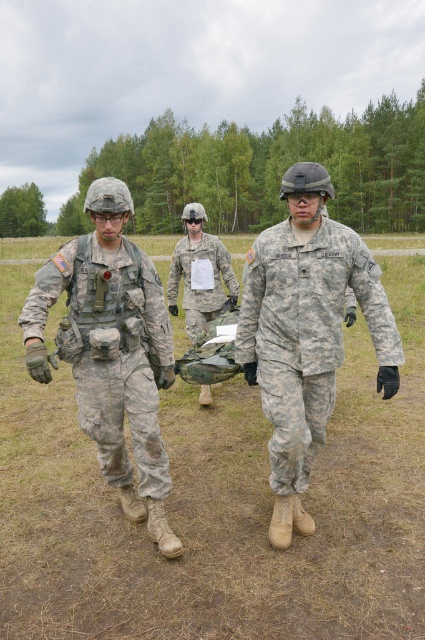
You are a photographer trying to capture a clear image of the camouflage uniform at center and the camouflage fabric bag at center. Since both are in the center, which one will appear wider in the photo?

The camouflage uniform at center will appear wider in the photo because its width surpasses that of the camouflage fabric bag at center.

You are a drone operator observing three soldiers in a training exercise. You notice two soldiers labeled as camouflage uniform at center and camouflage uniform at left. Which soldier is closer to the drone based on their size?

The camouflage uniform at center is smaller than camouflage uniform at left, so the camouflage uniform at left is closer to the drone since objects closer appear larger.